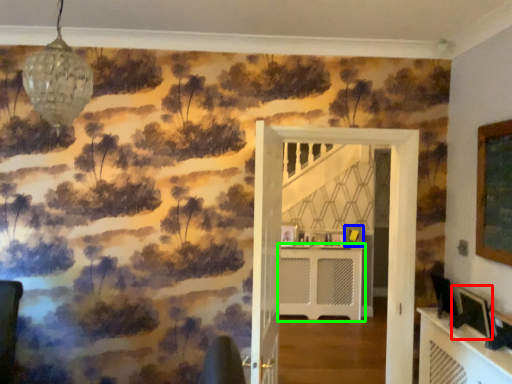
Question: Considering the real-world distances, which object is farthest from picture frame (highlighted by a red box)? picture frame (highlighted by a blue box) or table (highlighted by a green box)?

Choices:
 (A) picture frame
 (B) table

Answer: (B)